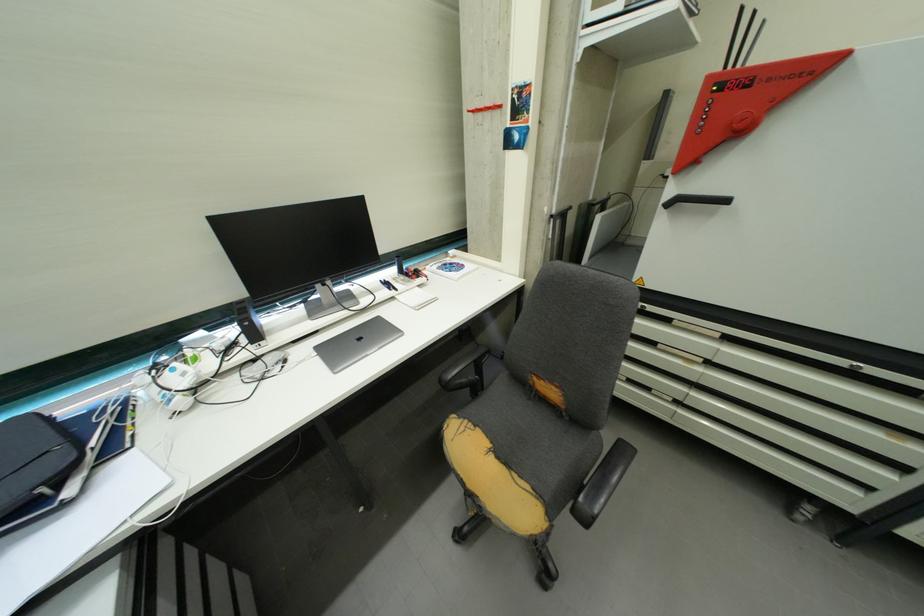
Locate an element on the screen. drawer handle indent is located at coordinates (199, 583).